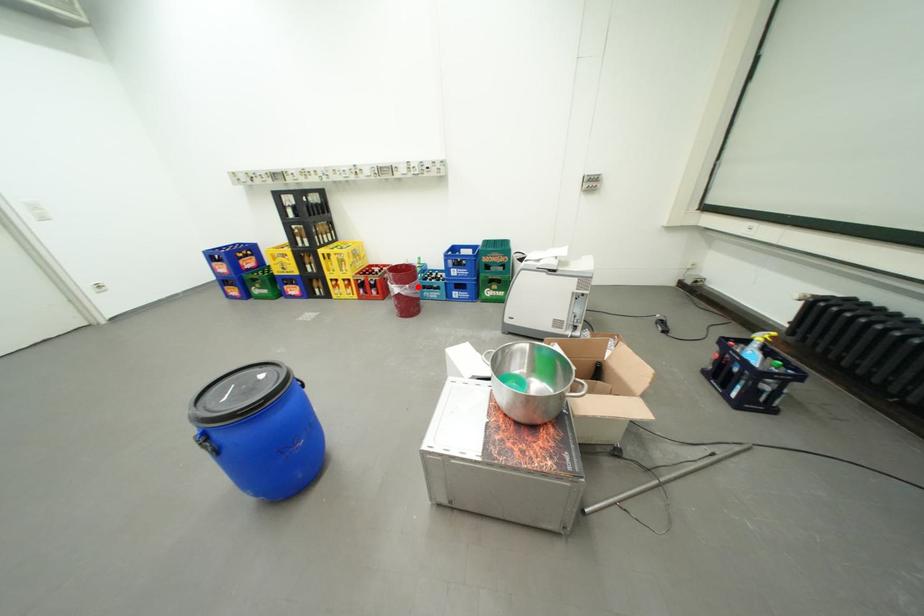
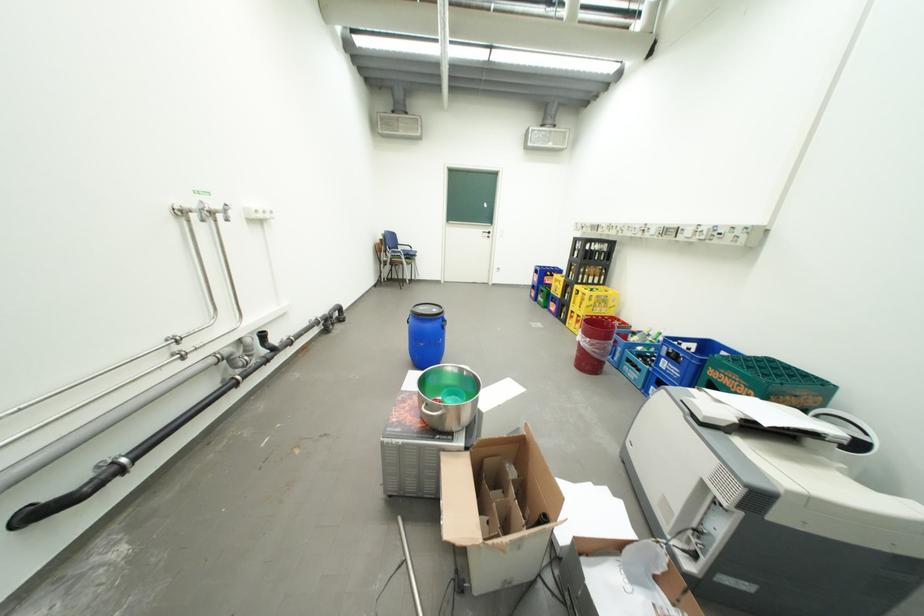
Find the pixel in the second image that matches the highlighted location in the first image.

(599, 341)